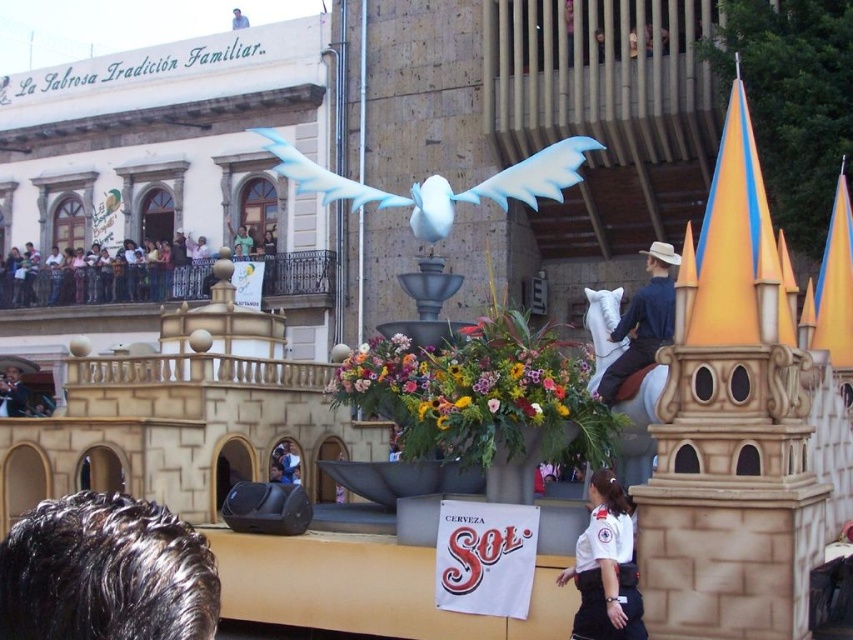
You are a photographer standing in front of the float. You want to capture a photo that includes both the white uniform at center and the light blue fabric at upper center. Which object should you frame first to ensure both are in the shot?

You should frame the light blue fabric at upper center first because it is wider than the white uniform at center, so it will take up more space in the photo.

Looking at the image of the festive parade float, can you identify what is located at the coordinates point (283,464)?

At point (283,464) lies smooth skin face at center.